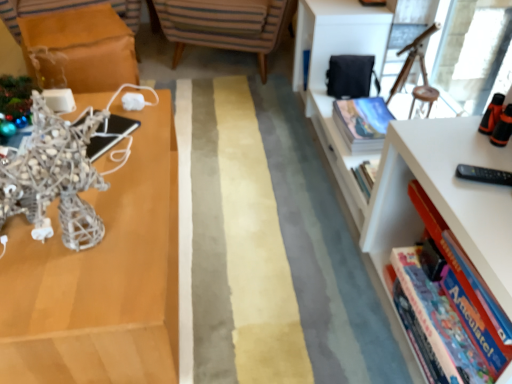
I want to click on vacant space situated above hardcover book at upper right, the 1th book viewed from the back (from a real-world perspective), so click(366, 112).